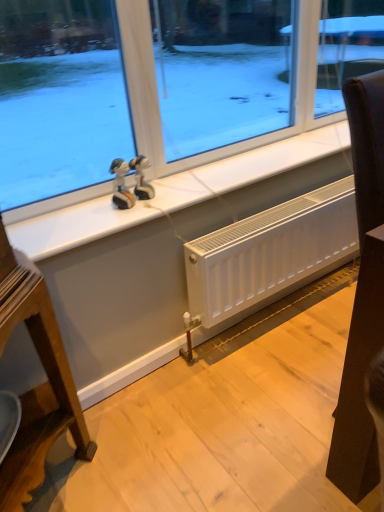
The width and height of the screenshot is (384, 512). What are the coordinates of `vacant space to the right of glossy plastic figurine at upper center, marked as the second figurine in a left-to-right arrangement` in the screenshot? It's located at (185, 190).